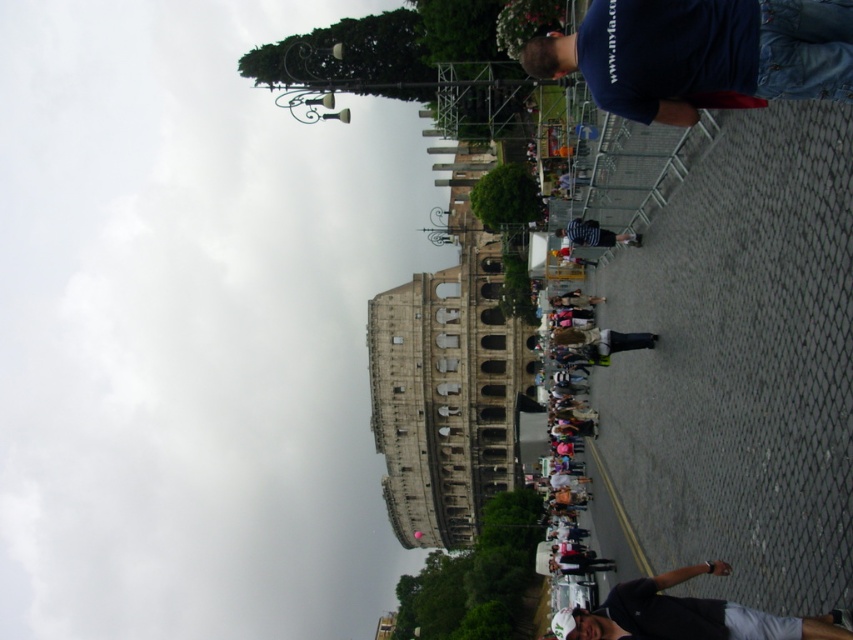
You are standing in the Colosseum plaza and want to take a photo of both the point at coordinates (606, 628) and the point at (590, 221). Which point should you focus on first to ensure both are in sharp focus?

You should focus on the point closer to the viewer, which is point (606, 628), to ensure both points are in sharp focus since it is nearer and the other point is further away.